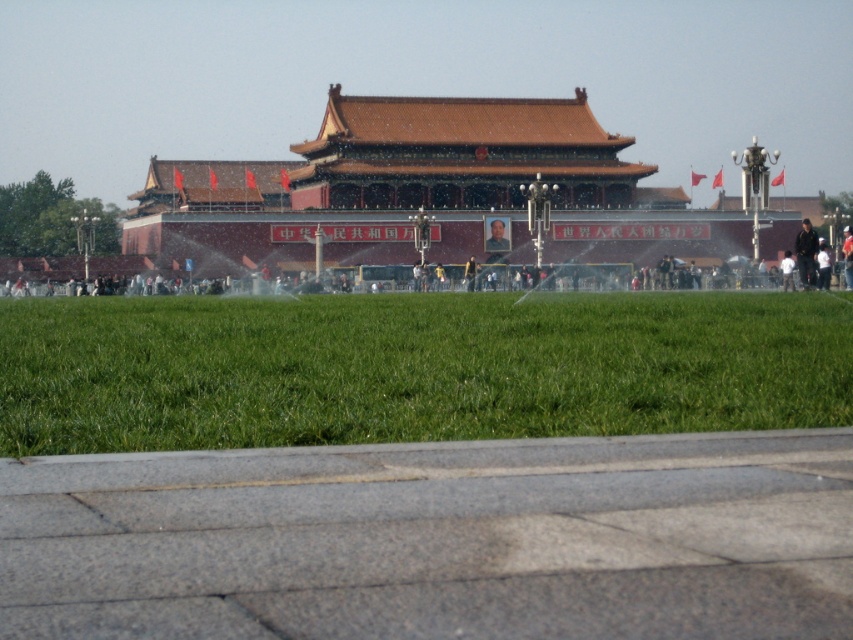
Which is in front, point (512, 115) or point (845, 264)?

Point (845, 264) is more forward.

Does brown wooden palace at center have a larger size compared to light brown leather jacket at right?

Yes.

Is point (235, 234) behind point (845, 243)?

Yes.

Image resolution: width=853 pixels, height=640 pixels. In order to click on brown wooden palace at center in this screenshot , I will do `click(426, 193)`.

Can you confirm if brown wooden palace at center is bigger than dark gray fabric jacket at right?

Correct, brown wooden palace at center is larger in size than dark gray fabric jacket at right.

Between brown wooden palace at center and dark gray fabric jacket at right, which one appears on the right side from the viewer's perspective?

Positioned to the right is brown wooden palace at center.

Find the location of a particular element. The height and width of the screenshot is (640, 853). brown wooden palace at center is located at coordinates (426, 193).

Does green grass at center have a greater height compared to brown wooden palace at center?

No.

I want to click on green grass at center, so click(x=413, y=368).

Image resolution: width=853 pixels, height=640 pixels. I want to click on green grass at center, so click(413, 368).